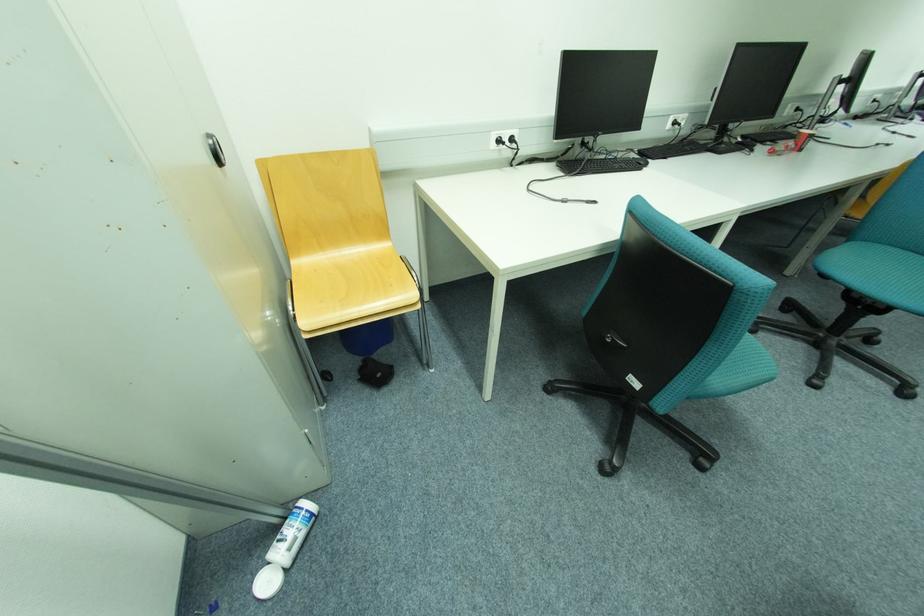
Identify the location of wooden chair sitting surface. The width and height of the screenshot is (924, 616). (350, 280).